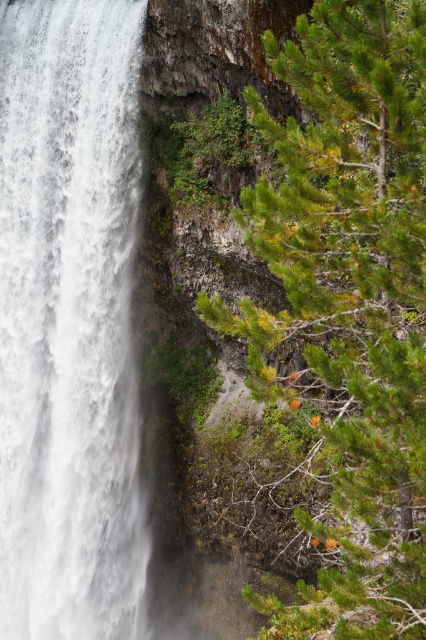
Question: Which point appears farthest from the camera in this image?

Choices:
 (A) (408, 374)
 (B) (11, 96)

Answer: (B)

Question: Which point appears farthest from the camera in this image?

Choices:
 (A) (103, 330)
 (B) (368, 467)

Answer: (A)

Question: Which of the following is the closest to the observer?

Choices:
 (A) green needle-like tree at right
 (B) white frothy water at left

Answer: (A)

Question: Is green needle-like tree at right to the left of white frothy water at left from the viewer's perspective?

Choices:
 (A) no
 (B) yes

Answer: (A)

Question: Does green needle-like tree at right have a lesser width compared to white frothy water at left?

Choices:
 (A) no
 (B) yes

Answer: (B)

Question: Is green needle-like tree at right above white frothy water at left?

Choices:
 (A) no
 (B) yes

Answer: (A)